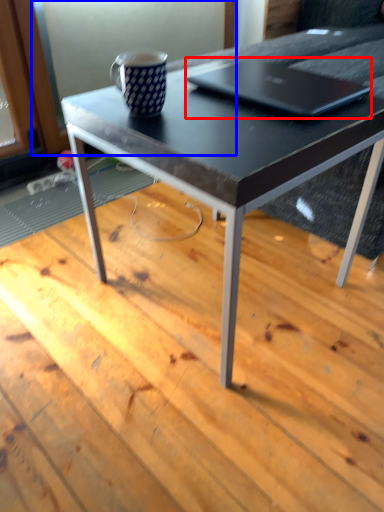
Question: Which object appears closest to the camera in this image, laptop (highlighted by a red box) or screen door (highlighted by a blue box)?

Choices:
 (A) laptop
 (B) screen door

Answer: (A)